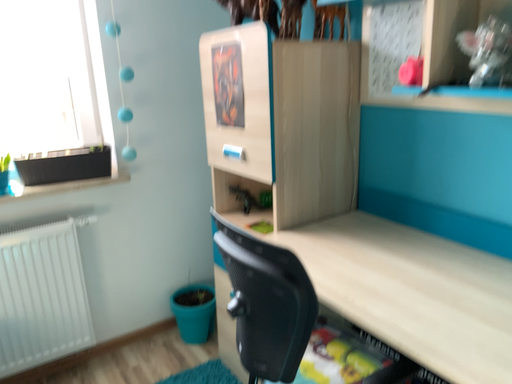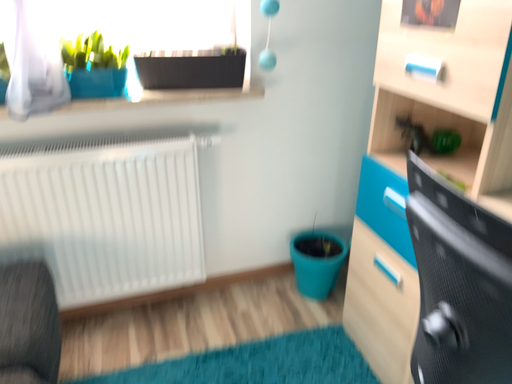
Question: Which way did the camera rotate in the video?

Choices:
 (A) rotated upward
 (B) rotated downward

Answer: (B)